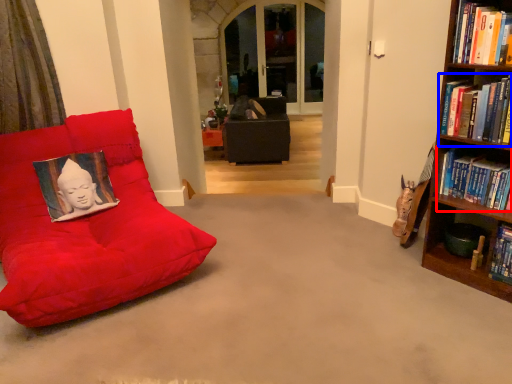
Question: Which object appears closest to the camera in this image, book (highlighted by a red box) or book (highlighted by a blue box)?

Choices:
 (A) book
 (B) book

Answer: (B)